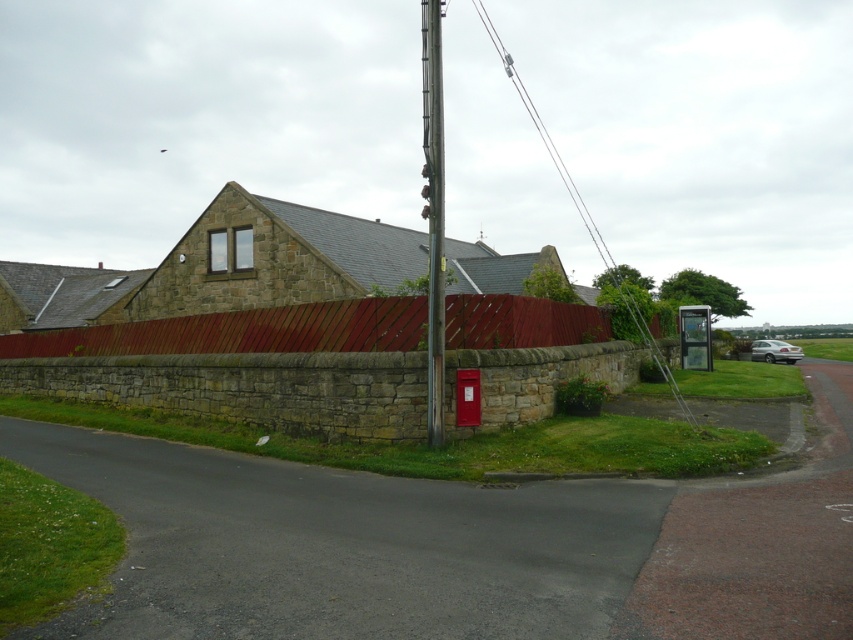
You are standing at the point marked as point (433, 211). What object is exactly at your current location?

The smooth metallic pole at center is located at point (433, 211).

Consider the image. You are a painter planning to paint the smooth metallic pole at center and the silver metallic car at right. If you have a limited amount of paint, which object requires more paint to cover its entire surface?

The silver metallic car at right requires more paint because its width is greater than the smooth metallic pole at center.